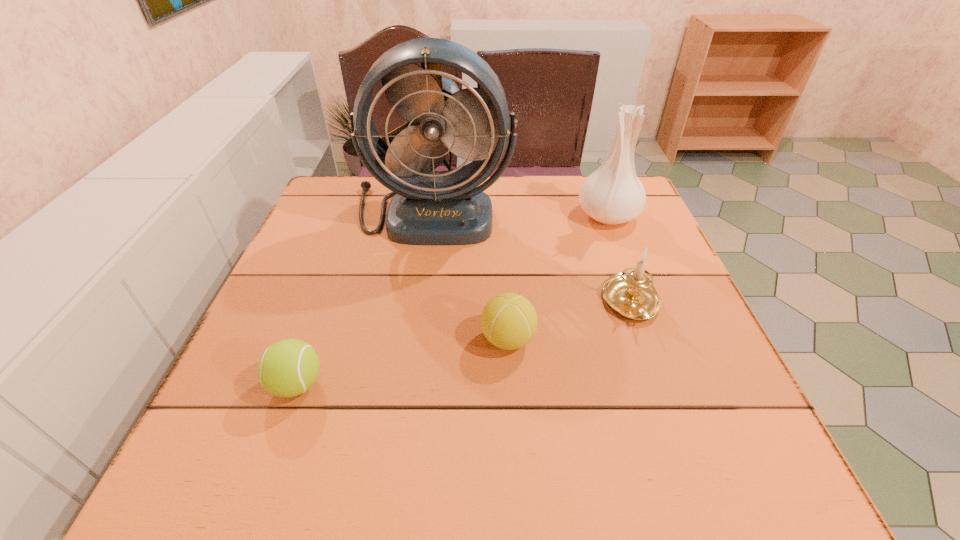
In order to click on vacant area between the right tennis ball and the second tallest object in this screenshot , I will do `click(558, 278)`.

This screenshot has height=540, width=960. Find the location of `vacant point located between the farther tennis ball and the nearer tennis ball`. vacant point located between the farther tennis ball and the nearer tennis ball is located at coordinates (402, 362).

Where is `blank region between the left tennis ball and the tallest object`? This screenshot has height=540, width=960. blank region between the left tennis ball and the tallest object is located at coordinates (365, 298).

This screenshot has height=540, width=960. Find the location of `empty space between the nearest object and the fan`. empty space between the nearest object and the fan is located at coordinates (365, 298).

The width and height of the screenshot is (960, 540). I want to click on free space between the candle holder and the right tennis ball, so click(570, 321).

This screenshot has height=540, width=960. Identify the location of free space between the tallest object and the vase. (520, 213).

Where is `object that stands as the third closest to the vase`? The image size is (960, 540). object that stands as the third closest to the vase is located at coordinates (509, 321).

Find the location of a particular element. object that is the third closest to the fourth shortest object is located at coordinates (509, 321).

Find the location of `free space that satisfies the following two spatial constraints: 1. on the back side of the left tennis ball; 2. on the right side of the right tennis ball`. free space that satisfies the following two spatial constraints: 1. on the back side of the left tennis ball; 2. on the right side of the right tennis ball is located at coordinates point(313,340).